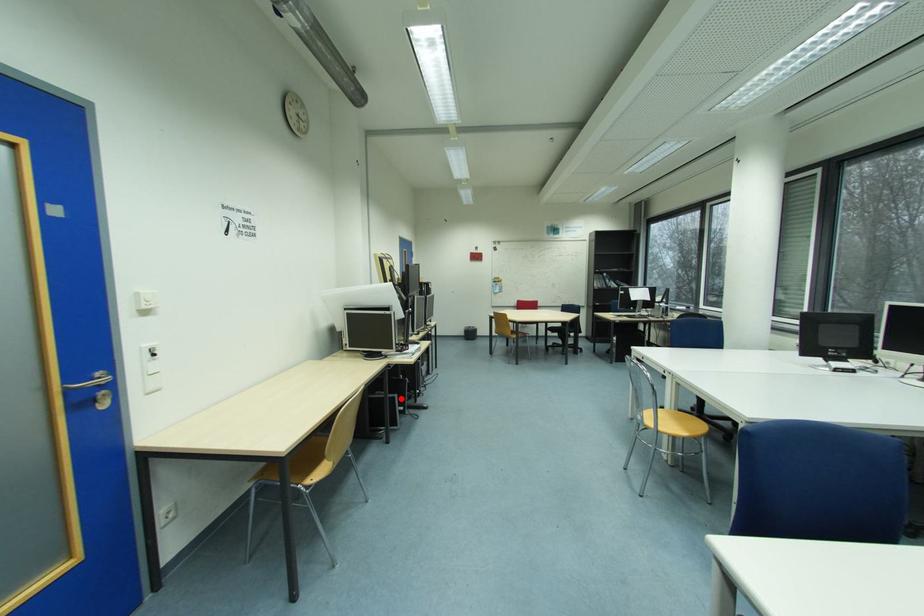
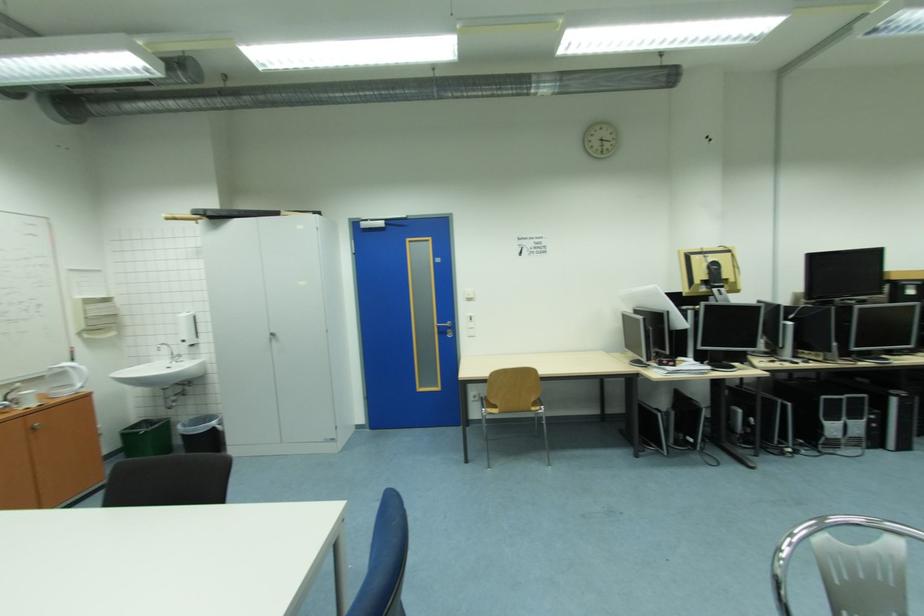
Find the pixel in the second image that matches the highlighted location in the first image.

(663, 416)